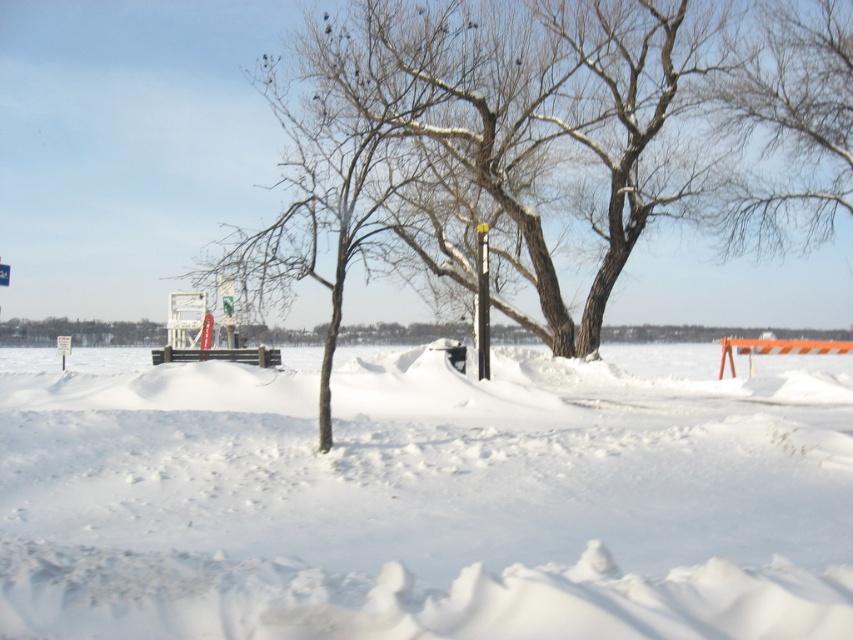
Question: Which of the following is the closest to the observer?

Choices:
 (A) (503, 573)
 (B) (57, 337)
 (C) (1, 268)

Answer: (A)

Question: Does white fluffy snow at center appear on the left side of black plastic pole at center?

Choices:
 (A) no
 (B) yes

Answer: (B)

Question: Estimate the real-world distances between objects in this image. Which object is closer to the white fluffy snow at center?

Choices:
 (A) white plastic sign at center
 (B) black plastic pole at center

Answer: (B)

Question: Does white fluffy snow at center appear on the right side of white plastic sign at upper left?

Choices:
 (A) no
 (B) yes

Answer: (B)

Question: Estimate the real-world distances between objects in this image. Which object is closer to the white plastic sign at upper left?

Choices:
 (A) black plastic pole at center
 (B) white plastic sign at center
 (C) white fluffy snow at center

Answer: (B)

Question: Does white plastic sign at center appear on the left side of white plastic sign at upper left?

Choices:
 (A) no
 (B) yes

Answer: (B)